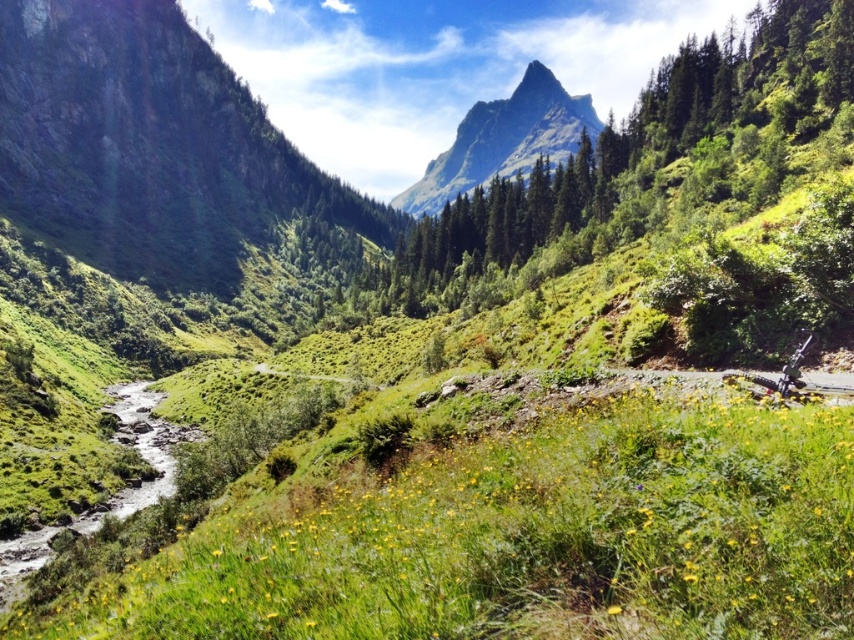
You are a hiker planning to traverse from the green rocky mountain at left to the rugged granite peak at upper center. Given that your hiking gear can handle slopes up to 30 degrees, can you estimate if the elevation difference between these two points is manageable?

The elevation difference between the green rocky mountain at left and the rugged granite peak at upper center cannot be determined from the provided information. The distance between them is 364.20 meters, but the angle of the slope or elevation change is not specified.

You are standing in the meadow and see the point marked at coordinates (149, 145). What does this point represent in the scene?

The point at coordinates (149, 145) represents the green rocky mountain at left.